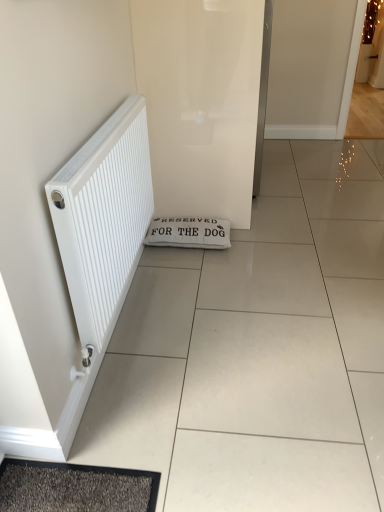
Question: Is white glossy screen door at center wider or thinner than white matte radiator at left?

Choices:
 (A) wide
 (B) thin

Answer: (A)

Question: Considering their positions, is white glossy screen door at center located in front of or behind white matte radiator at left?

Choices:
 (A) behind
 (B) front

Answer: (A)

Question: Based on their relative distances, which object is farther from the white fabric doormat at center?

Choices:
 (A) white matte radiator at left
 (B) white glossy screen door at center

Answer: (A)

Question: Which is farther from the white fabric doormat at center?

Choices:
 (A) white matte radiator at left
 (B) white glossy screen door at center

Answer: (A)